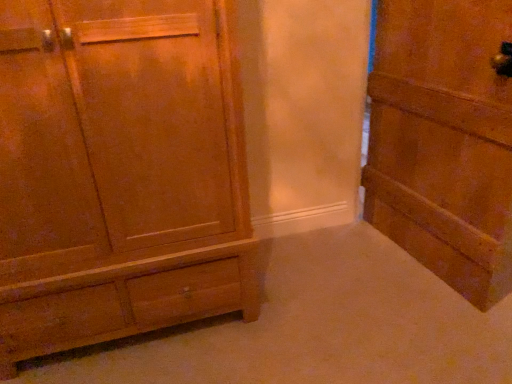
Question: From the image's perspective, is wooden door at right positioned above or below wooden cabinet at left?

Choices:
 (A) below
 (B) above

Answer: (B)

Question: Would you say wooden door at right is inside or outside wooden cabinet at left?

Choices:
 (A) inside
 (B) outside

Answer: (B)

Question: In terms of height, does wooden door at right look taller or shorter compared to wooden cabinet at left?

Choices:
 (A) short
 (B) tall

Answer: (A)

Question: In terms of size, does wooden cabinet at left appear bigger or smaller than wooden door at right?

Choices:
 (A) big
 (B) small

Answer: (A)

Question: In terms of width, does wooden cabinet at left look wider or thinner when compared to wooden door at right?

Choices:
 (A) wide
 (B) thin

Answer: (A)

Question: From their relative heights in the image, would you say wooden cabinet at left is taller or shorter than wooden door at right?

Choices:
 (A) tall
 (B) short

Answer: (A)

Question: Is point (166, 160) closer or farther from the camera than point (439, 173)?

Choices:
 (A) farther
 (B) closer

Answer: (B)